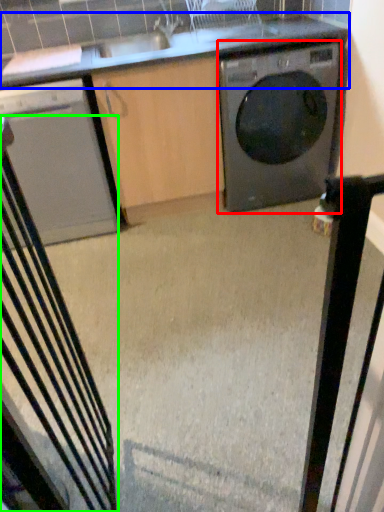
Question: Which object is the closest to the washing machine (highlighted by a red box)? Choose among these: countertop (highlighted by a blue box) or rocking chair (highlighted by a green box).

Choices:
 (A) countertop
 (B) rocking chair

Answer: (A)